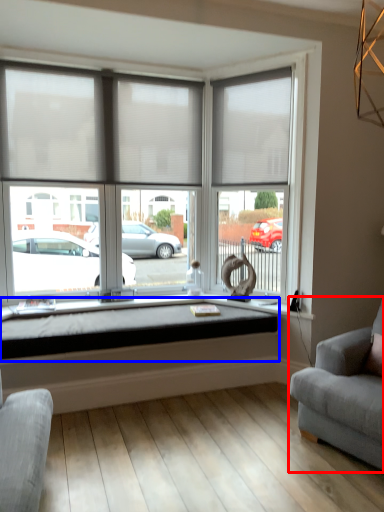
Question: Which point is closer to the camera, studio couch (highlighted by a red box) or window sill (highlighted by a blue box)?

Choices:
 (A) studio couch
 (B) window sill

Answer: (A)